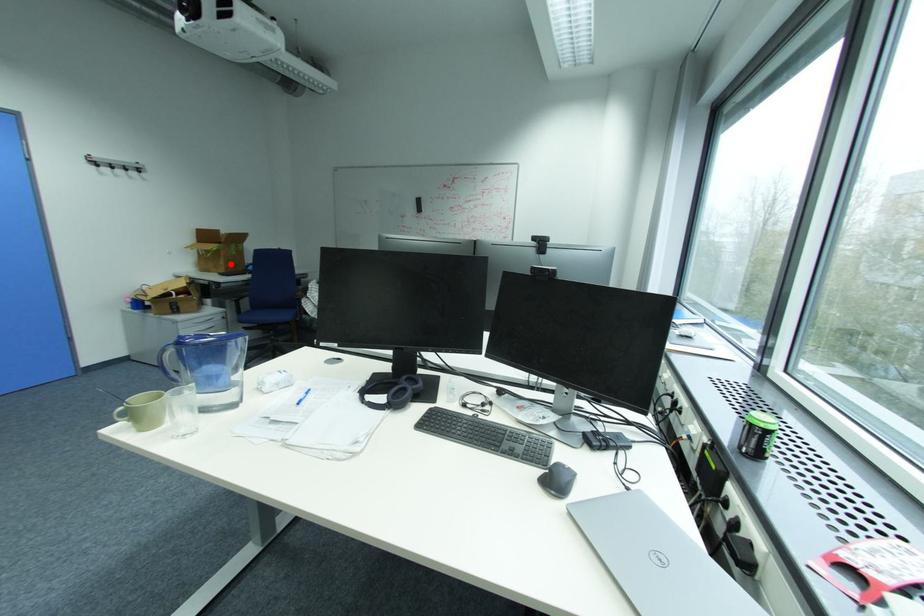
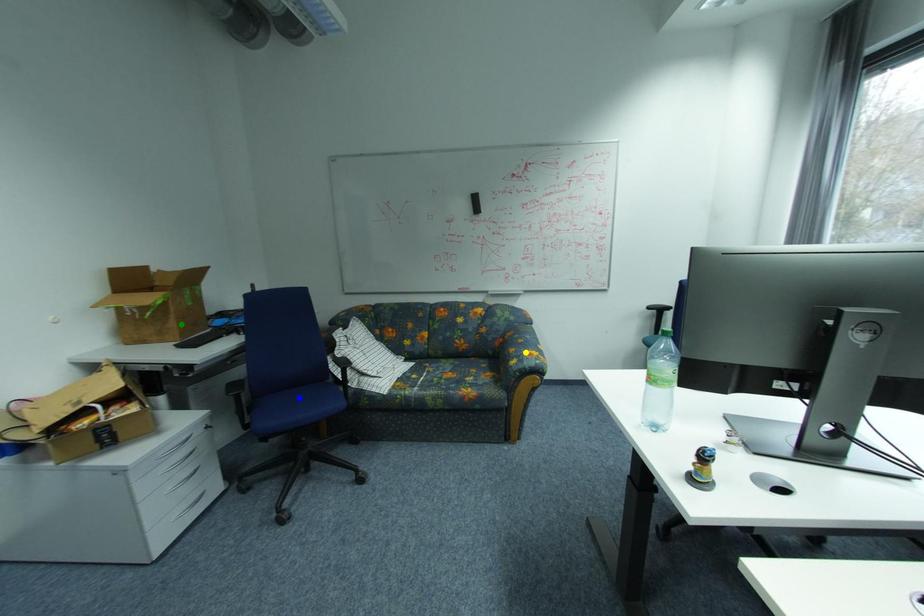
Question: I am providing you with two images of the same scene from different viewpoints. A red point is marked on the first image. You are given multiple points on the second image. Which point in image 2 represents the same 3d spot as the red point in image 1?

Choices:
 (A) green point
 (B) blue point
 (C) yellow point

Answer: (A)